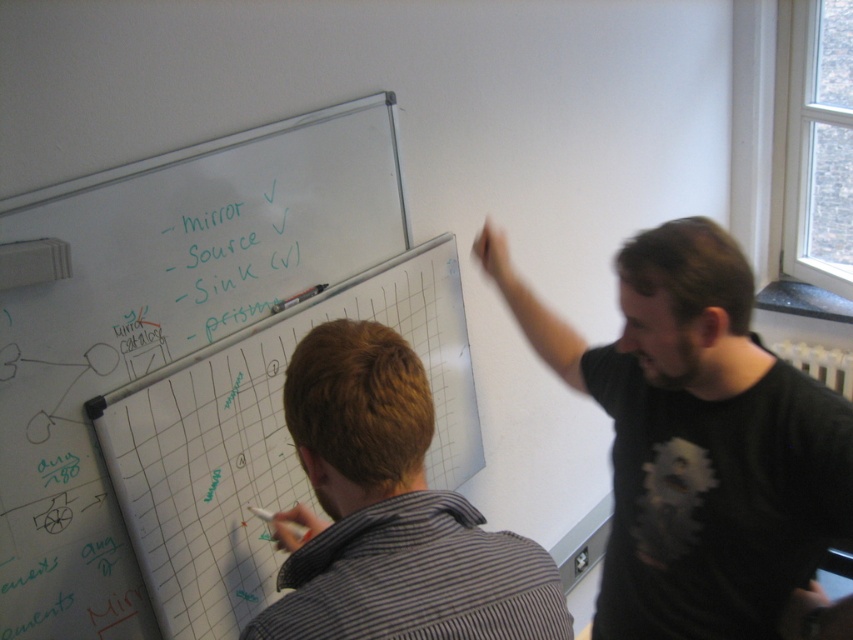
Question: Which point is farther from the camera taking this photo?

Choices:
 (A) (178, 481)
 (B) (711, 384)
 (C) (323, 632)

Answer: (A)

Question: Does whiteboard at upper left come in front of green marker text at upper center?

Choices:
 (A) yes
 (B) no

Answer: (A)

Question: Does black matte shirt at upper right appear on the left side of green marker text at upper center?

Choices:
 (A) no
 (B) yes

Answer: (A)

Question: Which point appears closest to the camera in this image?

Choices:
 (A) (196, 234)
 (B) (171, 529)
 (C) (810, 586)

Answer: (C)

Question: Which point is farther to the camera?

Choices:
 (A) (299, 474)
 (B) (225, 275)
 (C) (683, 326)
 (D) (397, 417)

Answer: (A)

Question: Is whiteboard at upper left further to camera compared to green marker text at upper center?

Choices:
 (A) yes
 (B) no

Answer: (B)